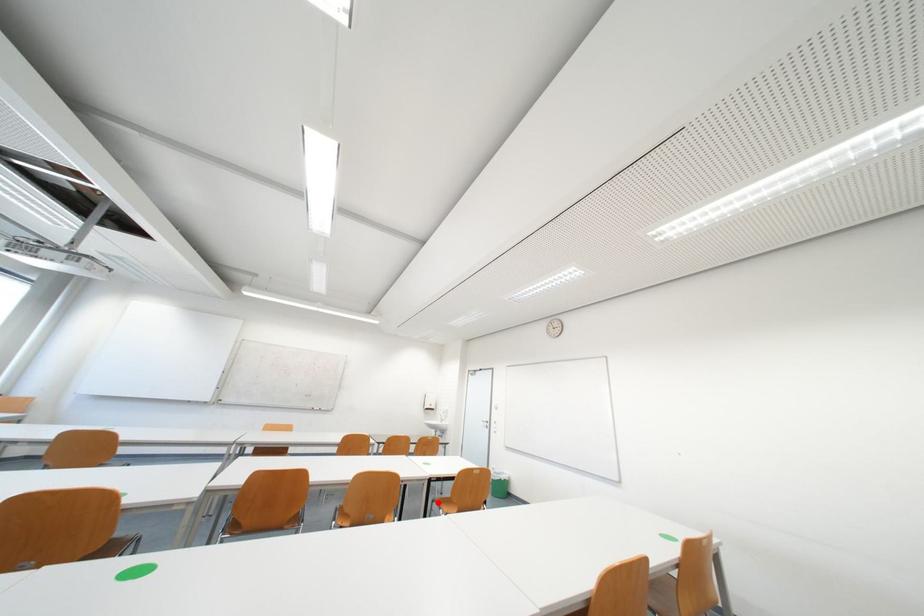
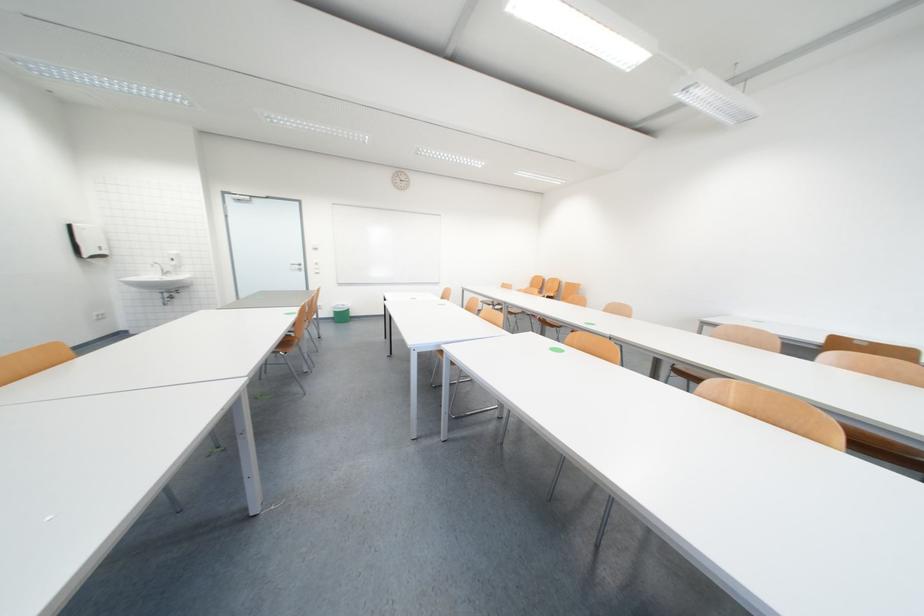
Question: I am providing you with two images of the same scene from different viewpoints. A red point is marked on the first image. At the location where the point appears in image 1, is it still visible in image 2?

Choices:
 (A) Yes
 (B) No

Answer: (B)